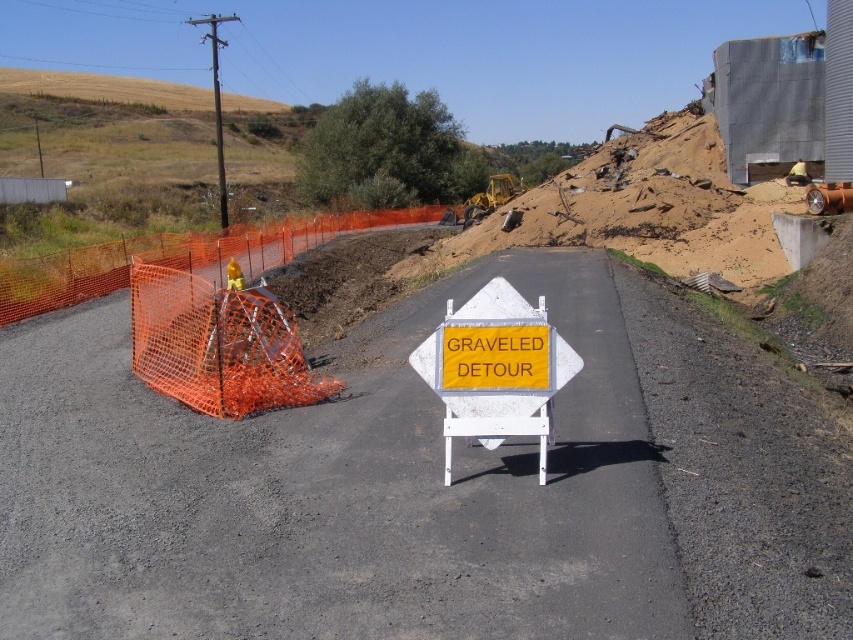
Question: Which object is positioned closest to the orange mesh fence at left?

Choices:
 (A) orange mesh barricade at left
 (B) yellow reflective plastic sign at center

Answer: (A)

Question: Which of these objects is positioned farthest from the yellow reflective plastic sign at center?

Choices:
 (A) orange mesh barricade at left
 (B) orange mesh fence at left

Answer: (B)

Question: In this image, where is yellow reflective plastic sign at center located relative to orange mesh fence at left?

Choices:
 (A) above
 (B) below

Answer: (B)

Question: Among these objects, which one is farthest from the camera?

Choices:
 (A) orange mesh barricade at left
 (B) orange mesh fence at left
 (C) yellow reflective plastic sign at center

Answer: (B)

Question: Can you confirm if orange mesh barricade at left is positioned to the left of orange mesh fence at left?

Choices:
 (A) yes
 (B) no

Answer: (B)

Question: From the image, what is the correct spatial relationship of yellow reflective plastic sign at center in relation to orange mesh fence at left?

Choices:
 (A) above
 (B) below

Answer: (B)